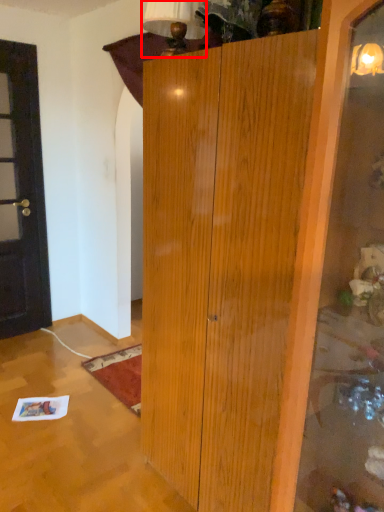
Question: Where is lamp (annotated by the red box) located in relation to door in the image?

Choices:
 (A) right
 (B) left

Answer: (A)